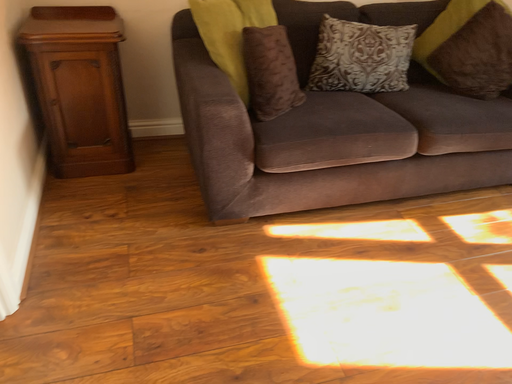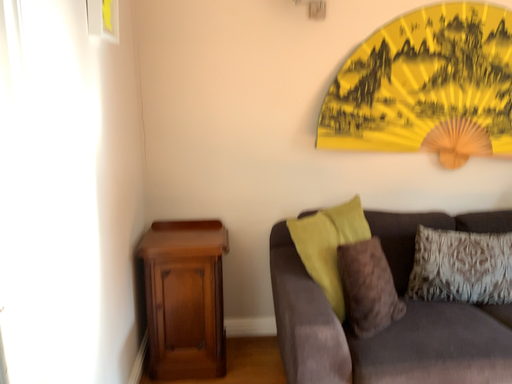
Question: How did the camera likely rotate when shooting the video?

Choices:
 (A) rotated left
 (B) rotated right

Answer: (A)